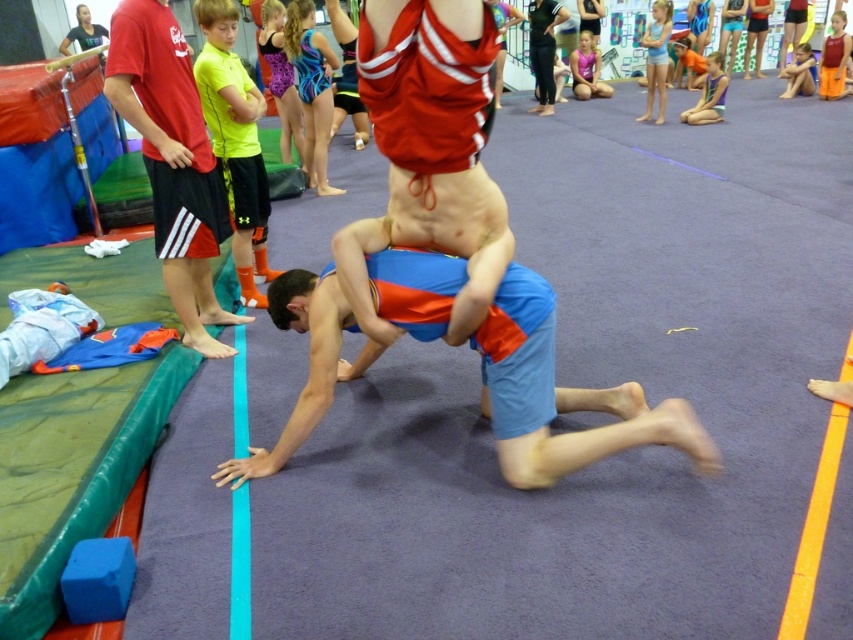
Does blue cotton shorts at center have a lesser height compared to blue shorts at lower right?

In fact, blue cotton shorts at center may be taller than blue shorts at lower right.

Is blue cotton shorts at center taller than blue shorts at lower right?

Yes.

Is point (498, 438) less distant than point (791, 77)?

Yes, it is in front of point (791, 77).

In order to click on blue cotton shorts at center in this screenshot , I will do `click(567, 401)`.

Consider the image. Which is more to the left, yellow matte shirt at upper left or blue shorts at lower right?

yellow matte shirt at upper left is more to the left.

Does point (245, 93) come behind point (799, 65)?

No, it is not.

You are a GUI agent. You are given a task and a screenshot of the screen. Output one action in this format:
    pyautogui.click(x=<x>, y=<y>)
    Task: Click on the yellow matte shirt at upper left
    The image size is (853, 640).
    Given the screenshot: What is the action you would take?
    pyautogui.click(x=235, y=141)

Does blue cotton shorts at center have a larger size compared to red shirt at left?

Yes.

Can you confirm if blue cotton shorts at center is thinner than red shirt at left?

Incorrect, blue cotton shorts at center's width is not less than red shirt at left's.

You are a GUI agent. You are given a task and a screenshot of the screen. Output one action in this format:
    pyautogui.click(x=<x>, y=<y>)
    Task: Click on the blue cotton shorts at center
    
    Given the screenshot: What is the action you would take?
    pyautogui.click(x=567, y=401)